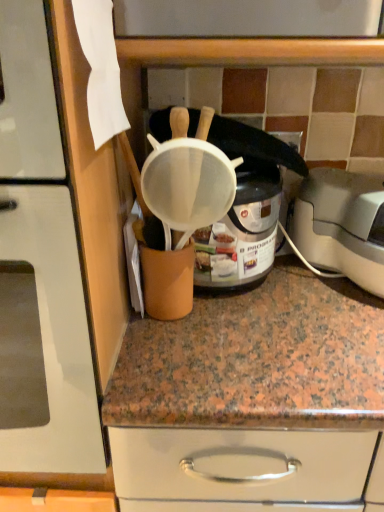
Question: Should I look upward or downward to see white mesh strainer at center?

Choices:
 (A) up
 (B) down

Answer: (A)

Question: Considering the relative sizes of matte white strainer at upper center and white mesh strainer at center in the image provided, is matte white strainer at upper center wider than white mesh strainer at center?

Choices:
 (A) yes
 (B) no

Answer: (A)

Question: Is matte white strainer at upper center closer to camera compared to white mesh strainer at center?

Choices:
 (A) no
 (B) yes

Answer: (B)

Question: Considering the relative sizes of matte white strainer at upper center and white mesh strainer at center in the image provided, is matte white strainer at upper center taller than white mesh strainer at center?

Choices:
 (A) no
 (B) yes

Answer: (B)

Question: Can you confirm if matte white strainer at upper center is smaller than white mesh strainer at center?

Choices:
 (A) no
 (B) yes

Answer: (A)

Question: Considering the relative sizes of matte white strainer at upper center and white mesh strainer at center in the image provided, is matte white strainer at upper center shorter than white mesh strainer at center?

Choices:
 (A) yes
 (B) no

Answer: (B)

Question: Is matte white strainer at upper center far away from white mesh strainer at center?

Choices:
 (A) no
 (B) yes

Answer: (A)

Question: Is white plastic toaster at right smaller than matte white strainer at upper center?

Choices:
 (A) yes
 (B) no

Answer: (A)

Question: From the image's perspective, does white plastic toaster at right appear lower than matte white strainer at upper center?

Choices:
 (A) no
 (B) yes

Answer: (B)

Question: From a real-world perspective, is white plastic toaster at right located beneath matte white strainer at upper center?

Choices:
 (A) no
 (B) yes

Answer: (B)

Question: Is there a large distance between white plastic toaster at right and matte white strainer at upper center?

Choices:
 (A) no
 (B) yes

Answer: (A)

Question: Is white plastic toaster at right to the left of matte white strainer at upper center from the viewer's perspective?

Choices:
 (A) no
 (B) yes

Answer: (A)

Question: From the image's perspective, is white plastic toaster at right over matte white strainer at upper center?

Choices:
 (A) yes
 (B) no

Answer: (B)

Question: Is the depth of matte white strainer at upper center greater than that of white plastic toaster at right?

Choices:
 (A) yes
 (B) no

Answer: (B)